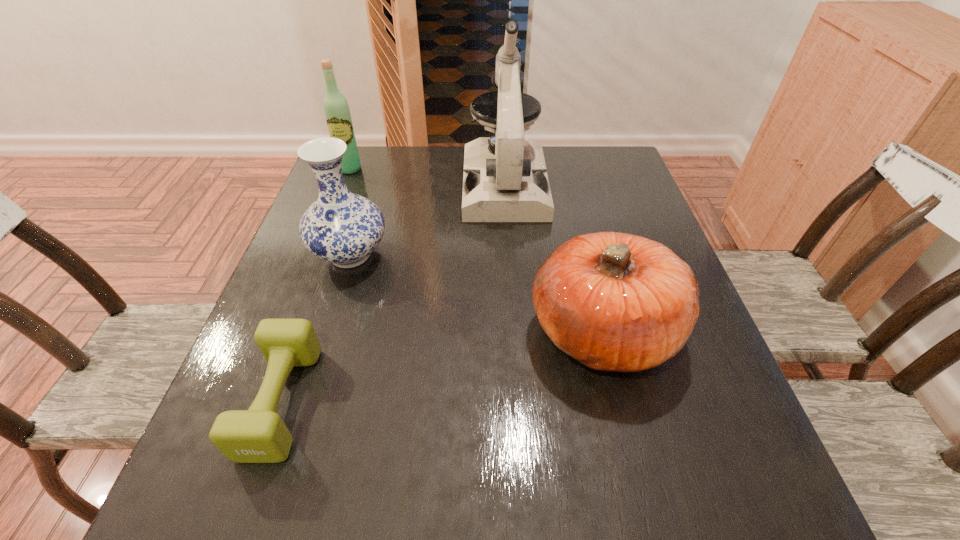
This screenshot has width=960, height=540. What are the coordinates of `object that is the third closest to the tallest object` in the screenshot? It's located at point(336,109).

Locate an element on the screen. Image resolution: width=960 pixels, height=540 pixels. object that stands as the fourth closest to the tallest object is located at coordinates (258, 435).

You are a GUI agent. You are given a task and a screenshot of the screen. Output one action in this format:
    pyautogui.click(x=<x>, y=<y>)
    Task: Click on the free space that satisfies the following two spatial constraints: 1. on the front-facing side of the wine bottle; 2. on the right side of the shortest object
    The width and height of the screenshot is (960, 540).
    Given the screenshot: What is the action you would take?
    pyautogui.click(x=260, y=401)

This screenshot has height=540, width=960. What are the coordinates of `vacant space that satisfies the following two spatial constraints: 1. on the front-facing side of the wine bottle; 2. on the right side of the dumbbell` in the screenshot? It's located at (260, 401).

The width and height of the screenshot is (960, 540). Find the location of `vacant space that satisfies the following two spatial constraints: 1. at the eyepiece of the tallest object; 2. on the right side of the pumpkin`. vacant space that satisfies the following two spatial constraints: 1. at the eyepiece of the tallest object; 2. on the right side of the pumpkin is located at coordinates (516, 332).

Locate an element on the screen. The width and height of the screenshot is (960, 540). vacant point that satisfies the following two spatial constraints: 1. on the front-facing side of the wine bottle; 2. on the right side of the fourth tallest object is located at coordinates (287, 332).

The image size is (960, 540). Find the location of `vacant space that satisfies the following two spatial constraints: 1. on the front side of the fourth tallest object; 2. on the left side of the vase`. vacant space that satisfies the following two spatial constraints: 1. on the front side of the fourth tallest object; 2. on the left side of the vase is located at coordinates (326, 332).

This screenshot has height=540, width=960. Find the location of `free space that satisfies the following two spatial constraints: 1. on the front-facing side of the shortest object; 2. on the left side of the wine bottle`. free space that satisfies the following two spatial constraints: 1. on the front-facing side of the shortest object; 2. on the left side of the wine bottle is located at coordinates (260, 401).